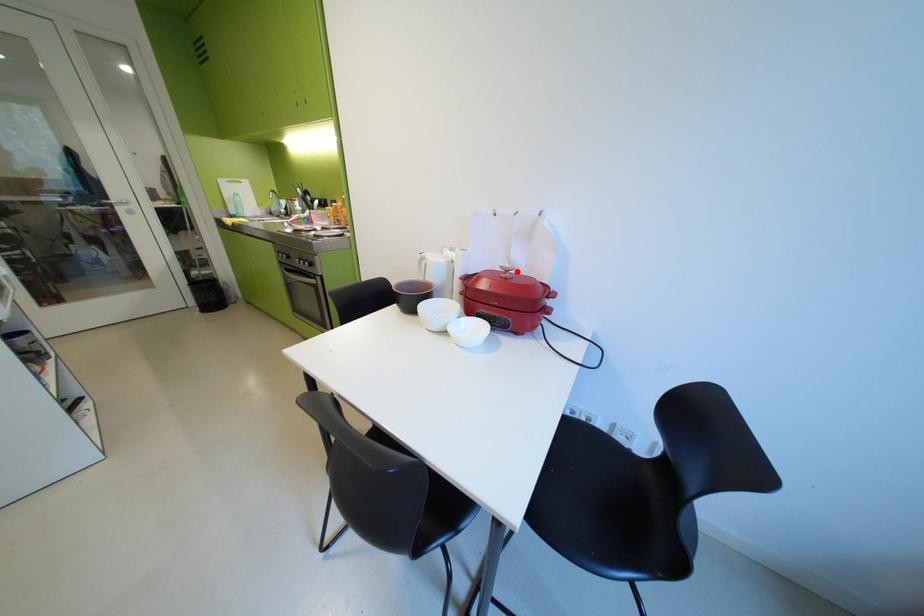
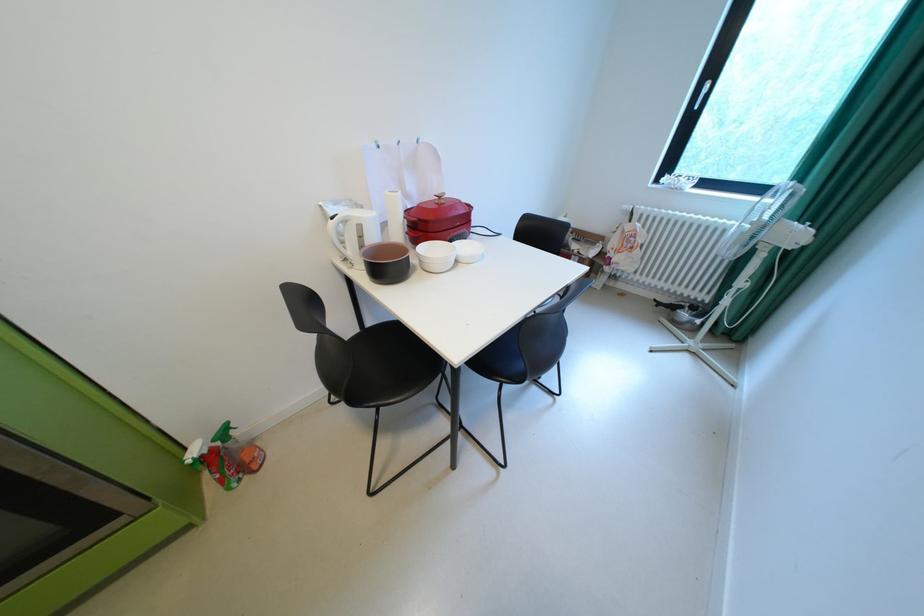
Question: I am providing you with two images of the same scene from different viewpoints. A red point is shown in image1. For the corresponding object point in image2, is it positioned nearer or farther from the camera?

Choices:
 (A) Nearer
 (B) Farther

Answer: (A)